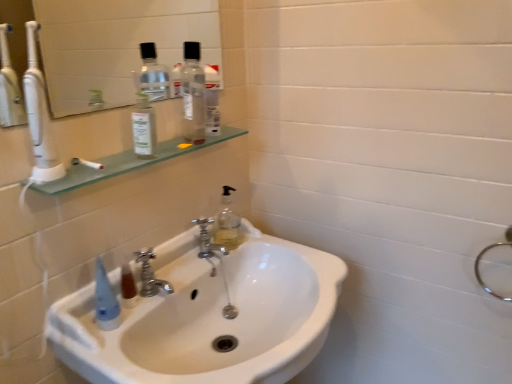
Question: Is clear glass mirror at upper left taller or shorter than transparent plastic bottle at upper center, which appears as the first bottle when viewed from the back?

Choices:
 (A) tall
 (B) short

Answer: (B)

Question: Considering the positions of clear glass mirror at upper left and transparent plastic bottle at upper center, positioned as the second bottle in left-to-right order, in the image, is clear glass mirror at upper left bigger or smaller than transparent plastic bottle at upper center, positioned as the second bottle in left-to-right order,?

Choices:
 (A) big
 (B) small

Answer: (A)

Question: Considering the real-world distances, which object is farthest from the clear glass bottle at upper left, the 2th bottle in the back-to-front sequence?

Choices:
 (A) transparent glass shelf at upper left
 (B) clear glass mirror at upper left
 (C) white glossy sink at center
 (D) translucent plastic mouthwash at sink
 (E) silver metallic faucet at center, the second tap viewed from the left

Answer: (B)

Question: Considering the real-world distances, which object is closest to the silver metallic faucet at center, the 1th tap viewed from the front?

Choices:
 (A) transparent plastic bottle at upper center, which appears as the first bottle when viewed from the back
 (B) silver metallic faucet at center, which is counted as the 2th tap, starting from the front
 (C) clear glass mirror at upper left
 (D) clear glass bottle at upper left, the 1th bottle when ordered from front to back
 (E) translucent plastic mouthwash at sink

Answer: (E)